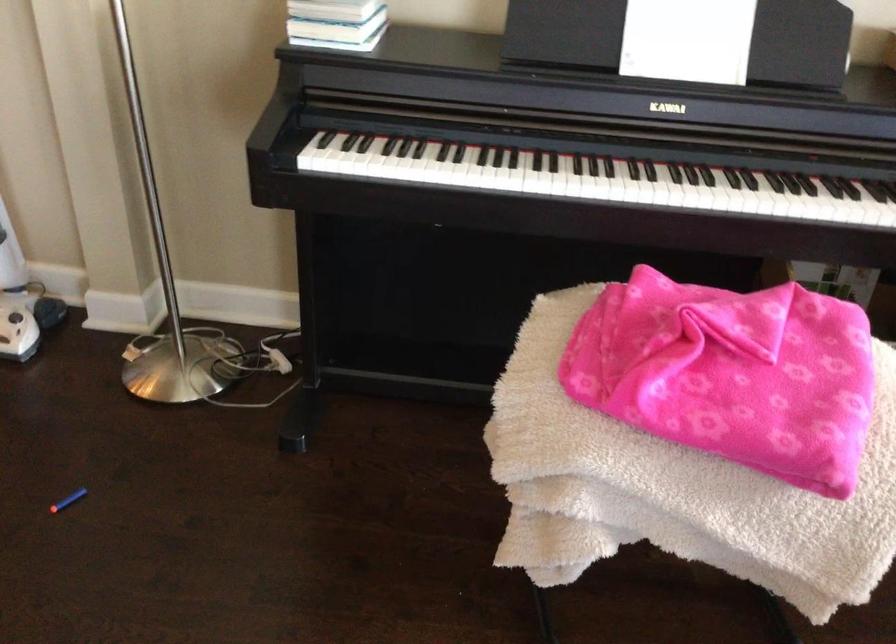
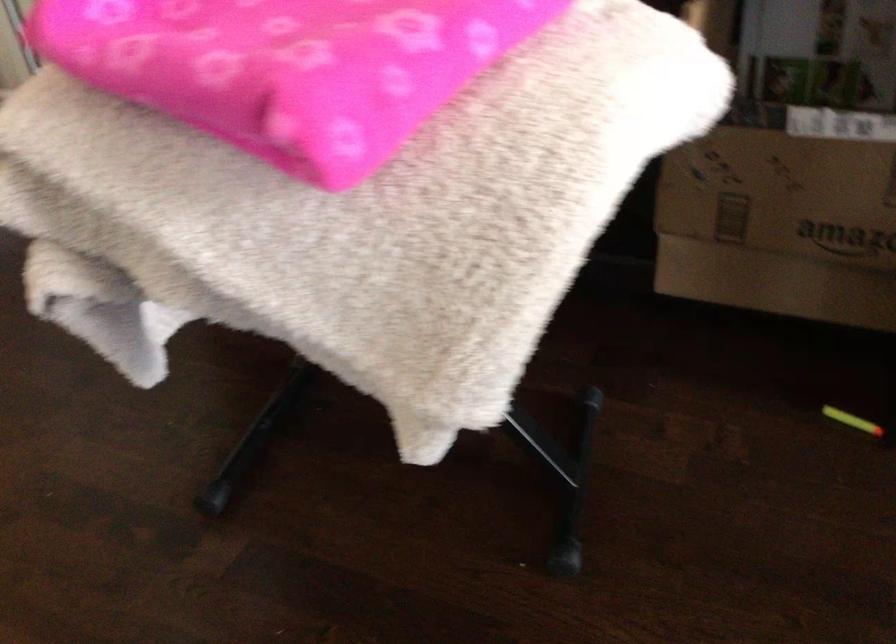
Find the pixel in the second image that matches point (820, 442) in the first image.

(288, 67)